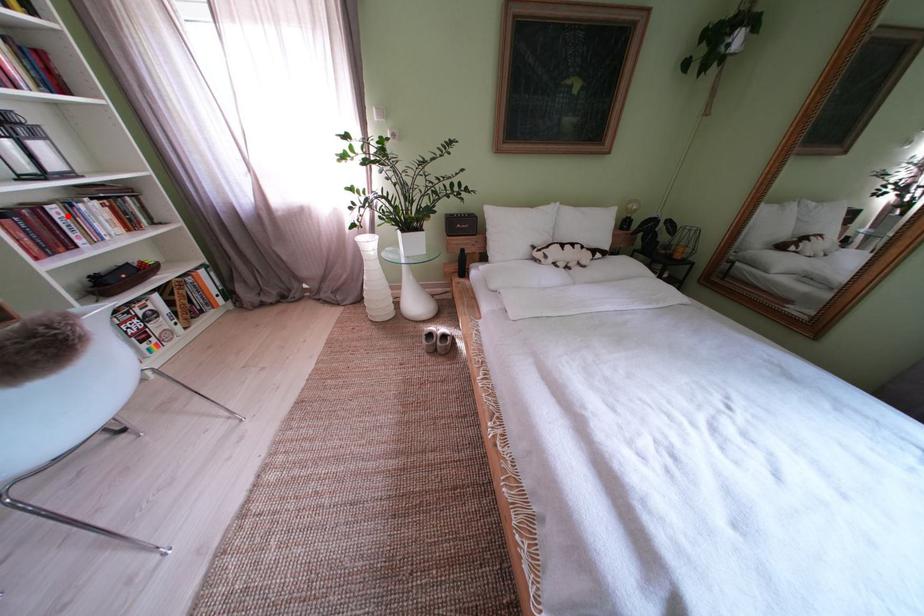
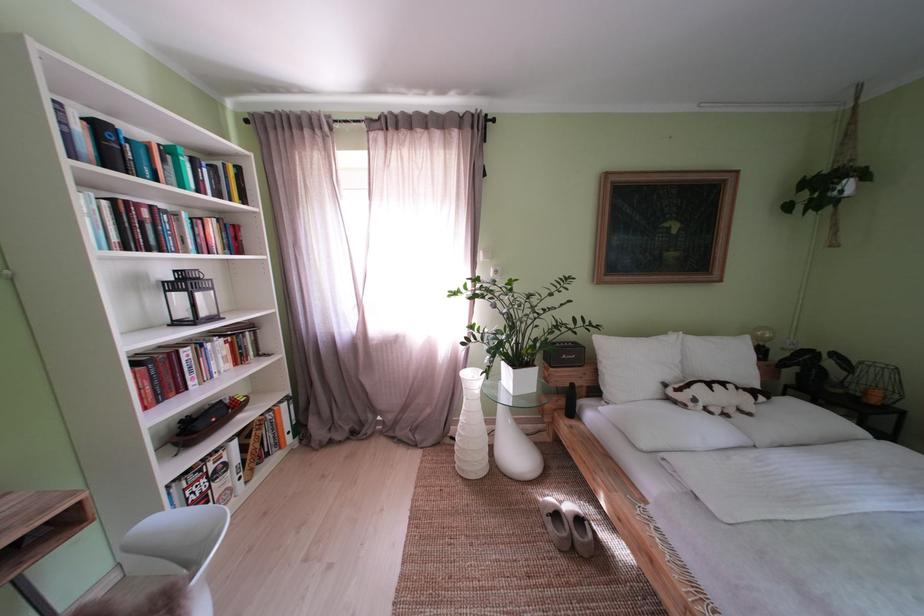
Where in the second image is the point corresponding to the highlighted location from the first image?

(199, 359)